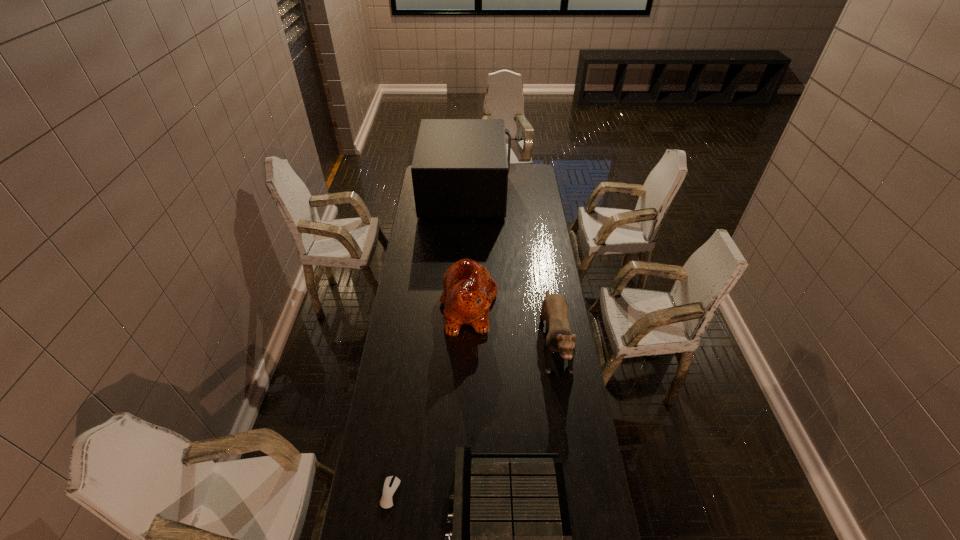
Find the location of a particular element. Image resolution: width=960 pixels, height=540 pixels. microwave oven present at the left edge is located at coordinates (460, 168).

In order to click on mouse at the left edge in this screenshot , I will do `click(391, 487)`.

In order to click on object situated at the right edge in this screenshot , I will do `click(554, 308)`.

Where is `object that is positioned at the far left corner`? This screenshot has width=960, height=540. object that is positioned at the far left corner is located at coordinates (460, 168).

In the image, there is a desktop. Identify the location of free space at the left edge. This screenshot has height=540, width=960. (404, 299).

The width and height of the screenshot is (960, 540). In the image, there is a desktop. What are the coordinates of `vacant space at the right edge` in the screenshot? It's located at (583, 471).

Identify the location of vacant space at the far right corner. (516, 167).

Where is `free space between the shortest object and the ferret`? The height and width of the screenshot is (540, 960). free space between the shortest object and the ferret is located at coordinates (472, 414).

Identify the location of vacant space that's between the mouse and the microwave oven. (428, 342).

The width and height of the screenshot is (960, 540). I want to click on unoccupied area between the tallest object and the mouse, so click(x=428, y=342).